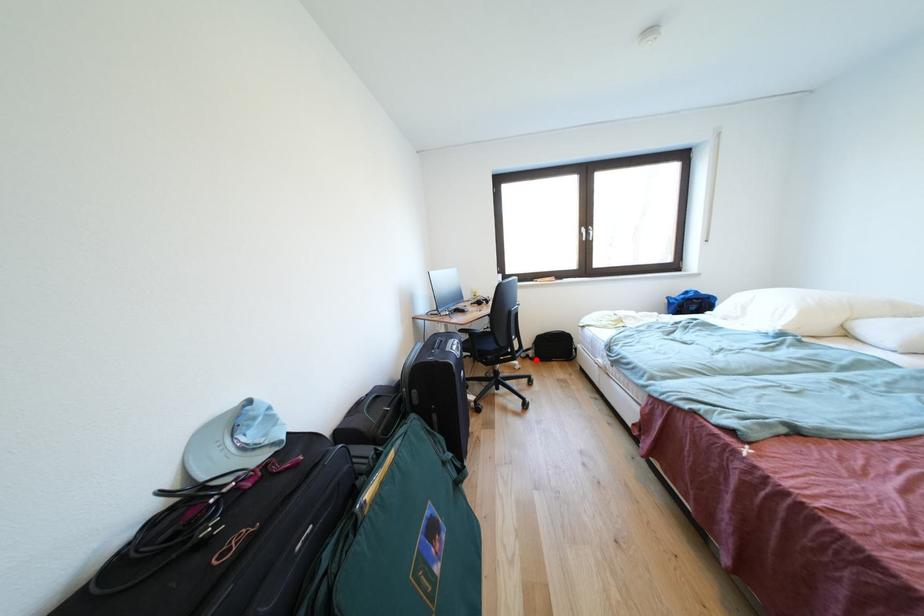
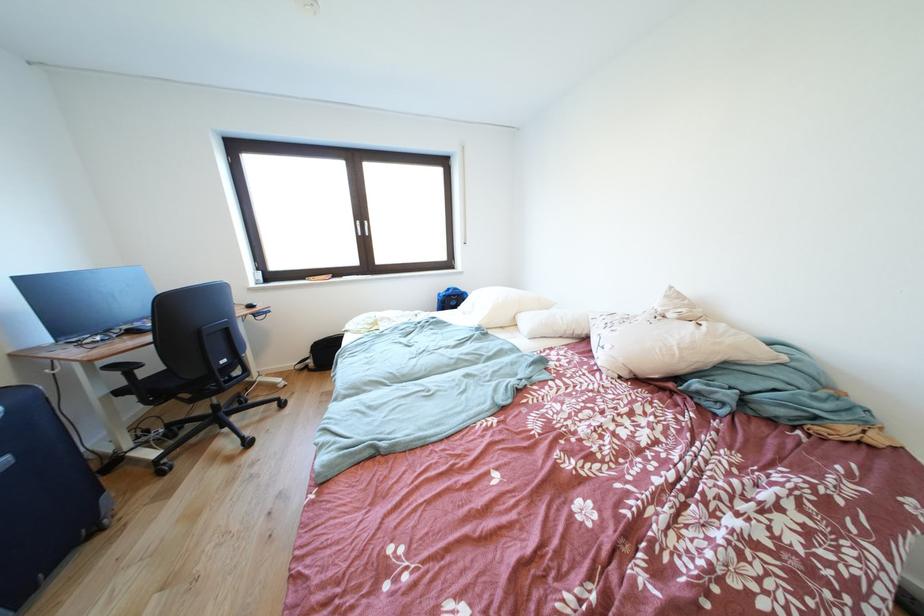
Find the pixel in the second image that matches the highlighted location in the first image.

(315, 371)